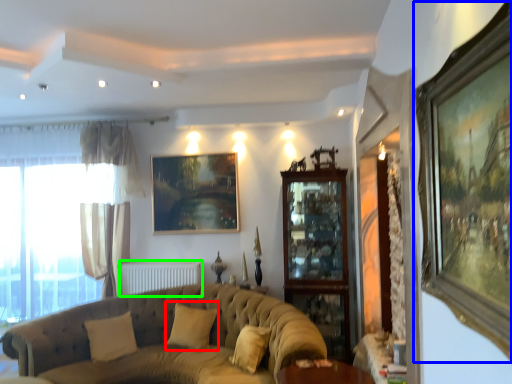
Question: Which object is positioned farthest from pillow (highlighted by a red box)? Select from picture frame (highlighted by a blue box) and radiator (highlighted by a green box).

Choices:
 (A) picture frame
 (B) radiator

Answer: (A)